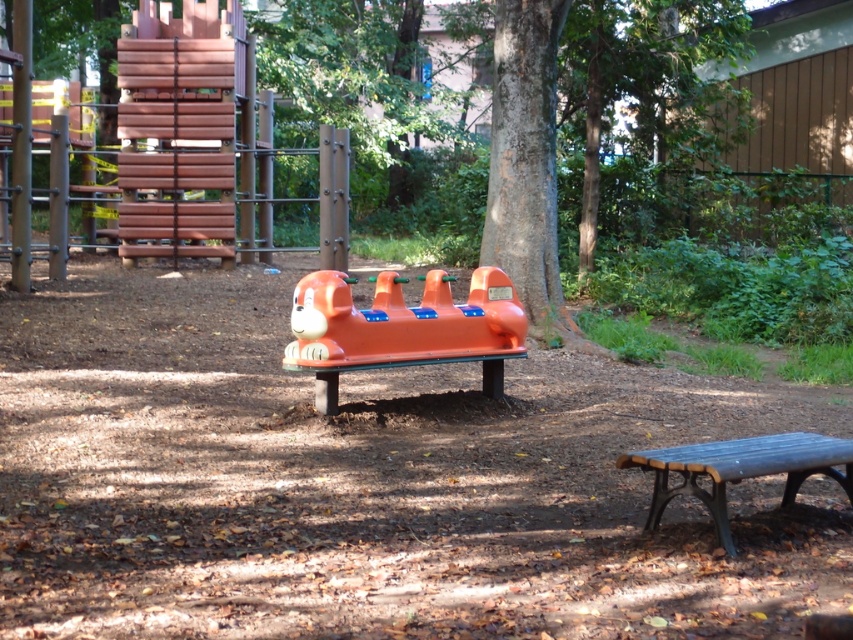
Which is below, orange plastic toy at center or wooden bench at lower right?

wooden bench at lower right

Does point (308, 310) come farther from viewer compared to point (791, 477)?

Yes, point (308, 310) is behind point (791, 477).

The image size is (853, 640). In order to click on orange plastic toy at center in this screenshot , I will do click(x=401, y=326).